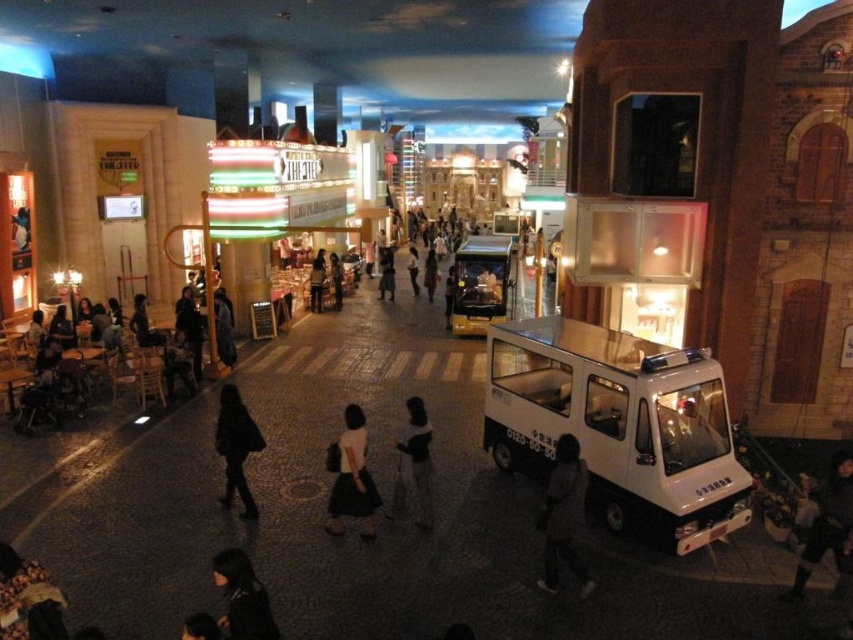
From the picture: You are a photographer standing at the entrance of the mall. You want to take a picture of the white matte skirt at center. Where should you position yourself to ensure the skirt is in the center of your photo?

To ensure the white matte skirt at center is in the center of your photo, position yourself directly in front of it at point (352, 477).